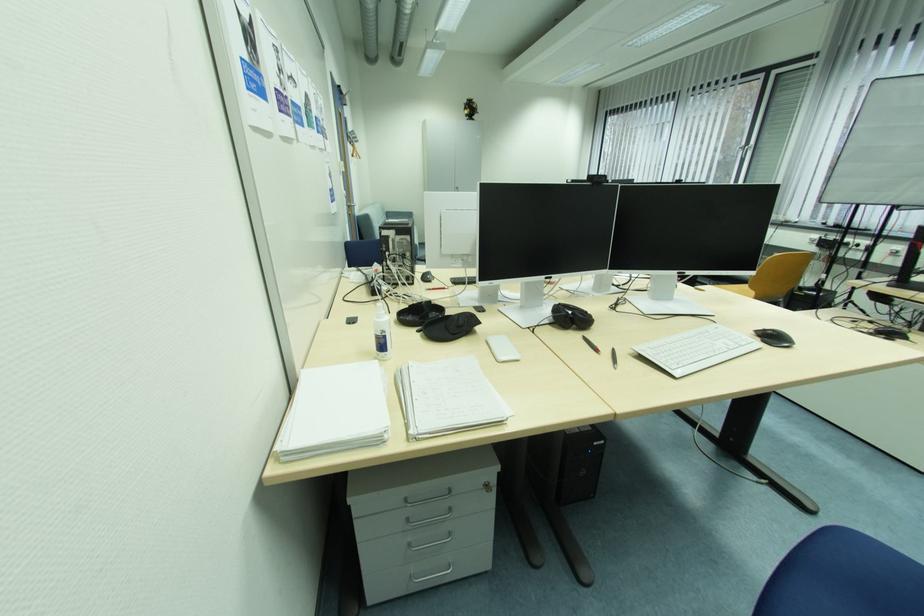
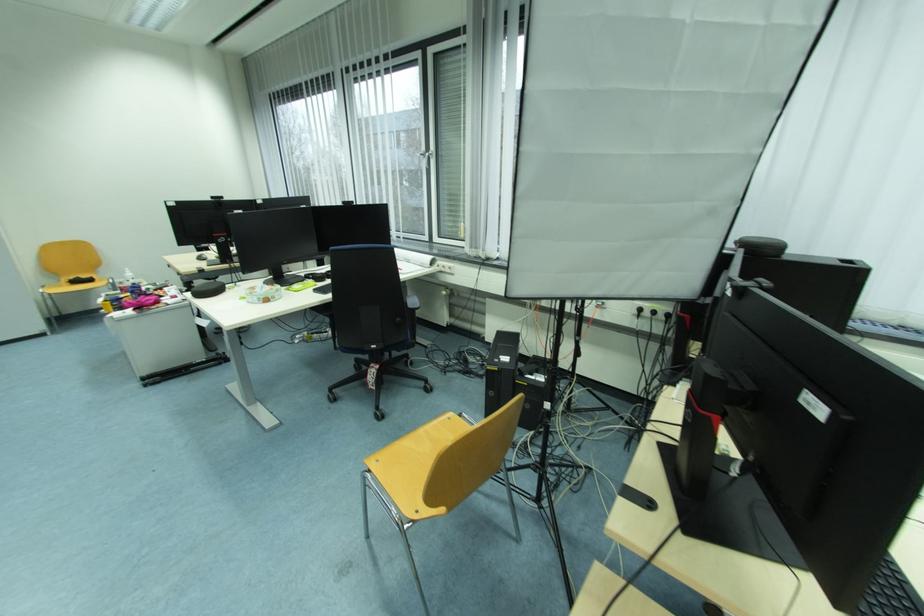
Where in the second image is the point corresponding to (749,145) from the first image?

(431, 150)